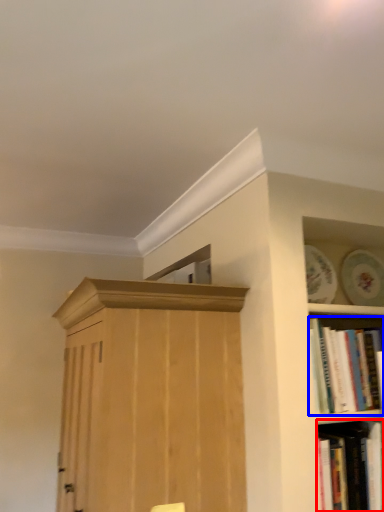
Question: Among these objects, which one is farthest to the camera, book (highlighted by a red box) or book (highlighted by a blue box)?

Choices:
 (A) book
 (B) book

Answer: (B)